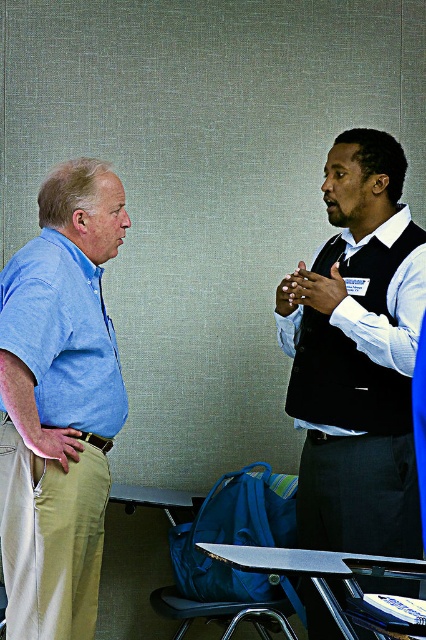
Is point (39, 340) closer to viewer compared to point (406, 204)?

Yes, point (39, 340) is in front of point (406, 204).

Locate an element on the screen. khaki pants at left is located at coordinates (60, 396).

Can you confirm if black vest at center is shorter than white glossy shirt at center?

No.

Can you confirm if black vest at center is positioned below white glossy shirt at center?

Yes.

This screenshot has width=426, height=640. Identify the location of black vest at center. (357, 356).

At what (x,y) coordinates should I click in order to perform the action: click on black vest at center. Please return your answer as a coordinate pair (x, y). Image resolution: width=426 pixels, height=640 pixels. Looking at the image, I should click on (357, 356).

Can you confirm if black vest at center is shorter than khaki pants at left?

Incorrect, black vest at center's height does not fall short of khaki pants at left's.

Who is positioned more to the left, black vest at center or khaki pants at left?

From the viewer's perspective, khaki pants at left appears more on the left side.

Is point (406, 412) closer to viewer compared to point (43, 636)?

That is False.

I want to click on black vest at center, so click(x=357, y=356).